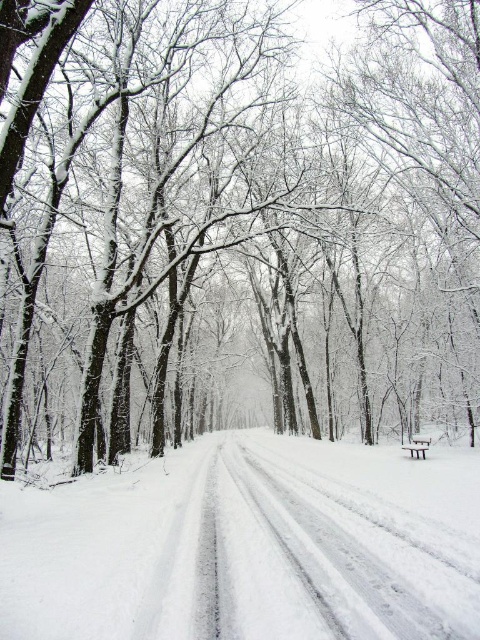
Question: Does white powdery snow at center have a greater width compared to wooden park bench at center?

Choices:
 (A) yes
 (B) no

Answer: (A)

Question: Which point appears closest to the camera in this image?

Choices:
 (A) (x=429, y=444)
 (B) (x=13, y=595)

Answer: (B)

Question: From the image, what is the correct spatial relationship of white powdery snow at center in relation to wooden park bench at center?

Choices:
 (A) left
 (B) right

Answer: (A)

Question: Is white powdery snow at center thinner than wooden park bench at center?

Choices:
 (A) yes
 (B) no

Answer: (B)

Question: Which point is closer to the camera?

Choices:
 (A) wooden park bench at center
 (B) white powdery snow at center

Answer: (B)